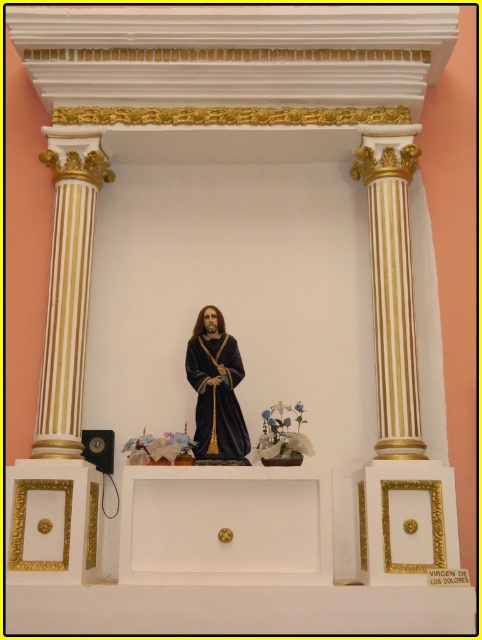
Question: In this image, where is gold striped column at left located relative to gold striped column at right?

Choices:
 (A) left
 (B) right

Answer: (A)

Question: Is gold striped column at left thinner than gold striped column at right?

Choices:
 (A) yes
 (B) no

Answer: (B)

Question: Which point is closer to the camera taking this photo?

Choices:
 (A) [388, 380]
 (B) [68, 289]

Answer: (A)

Question: Which object is farther from the camera taking this photo?

Choices:
 (A) gold striped column at left
 (B) gold striped column at right

Answer: (A)

Question: Where is gold striped column at left located in relation to gold striped column at right in the image?

Choices:
 (A) below
 (B) above

Answer: (A)

Question: Which of the following is the closest to the observer?

Choices:
 (A) velvet-like dark blue statue at center
 (B) gold striped column at left

Answer: (A)